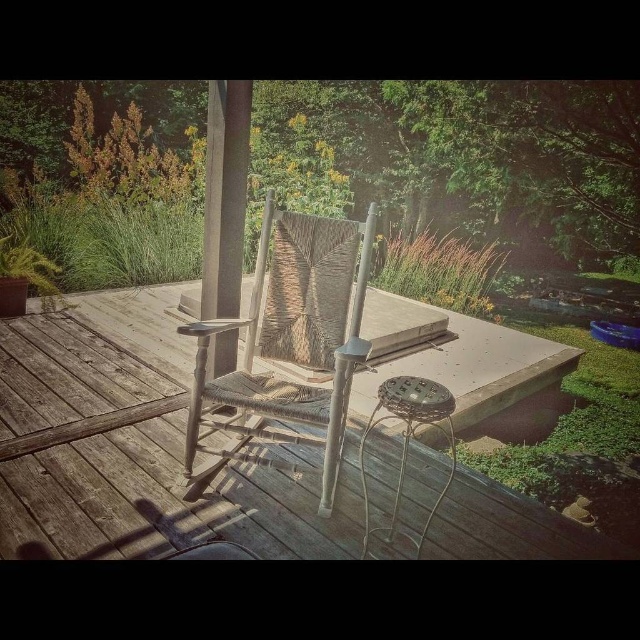
Is point (54, 541) behind point (396, 508)?

No, it is not.

What do you see at coordinates (134, 445) in the screenshot? I see `weathered wood deck at center` at bounding box center [134, 445].

The image size is (640, 640). I want to click on weathered wood deck at center, so click(134, 445).

Is woven wood chair at center wider than metallic wire stool at center?

Correct, the width of woven wood chair at center exceeds that of metallic wire stool at center.

This screenshot has height=640, width=640. In order to click on woven wood chair at center in this screenshot , I will do `click(276, 381)`.

Locate an element on the screen. The height and width of the screenshot is (640, 640). woven wood chair at center is located at coordinates (276, 381).

Describe the element at coordinates (134, 445) in the screenshot. The width and height of the screenshot is (640, 640). I see `weathered wood deck at center` at that location.

Who is more forward, (108, 305) or (321, 253)?

Positioned in front is point (321, 253).

Locate an element on the screen. The height and width of the screenshot is (640, 640). weathered wood deck at center is located at coordinates (134, 445).

Locate an element on the screen. weathered wood deck at center is located at coordinates (134, 445).